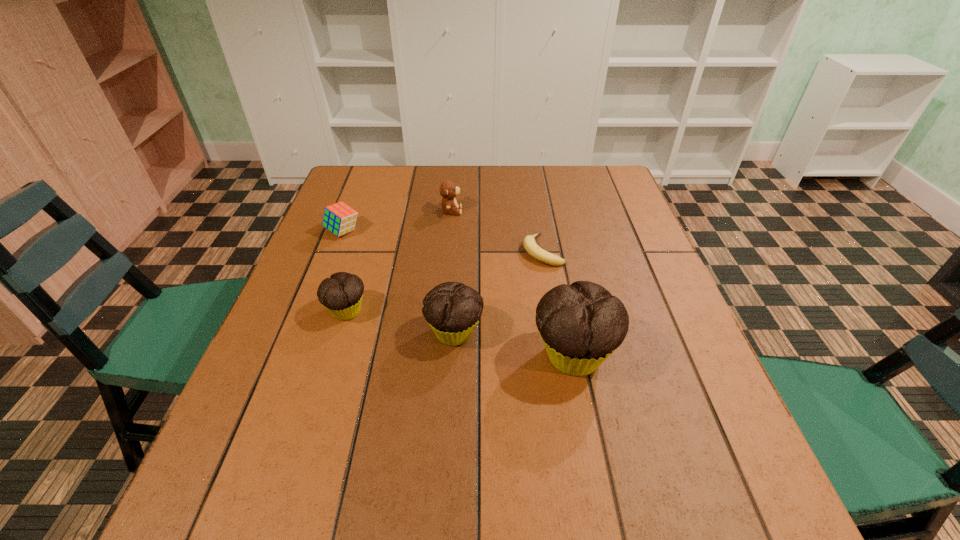
Find the location of a particular element. The width and height of the screenshot is (960, 540). free location at the right edge is located at coordinates (583, 207).

This screenshot has width=960, height=540. I want to click on free spot at the far left corner of the desktop, so tap(370, 166).

Image resolution: width=960 pixels, height=540 pixels. I want to click on vacant area at the far right corner, so click(574, 179).

Find the location of a particular element. vacant region between the rightmost muffin and the second shortest muffin is located at coordinates (514, 344).

Locate an element on the screen. The width and height of the screenshot is (960, 540). free space that is in between the leftmost muffin and the teddy bear is located at coordinates (399, 261).

I want to click on empty location between the teddy bear and the cube, so click(x=397, y=221).

This screenshot has width=960, height=540. I want to click on vacant area that lies between the teddy bear and the cube, so click(397, 221).

Where is `free area in between the cube and the banana`? This screenshot has width=960, height=540. free area in between the cube and the banana is located at coordinates (443, 241).

Image resolution: width=960 pixels, height=540 pixels. I want to click on vacant point located between the cube and the farthest object, so click(x=397, y=221).

You are a GUI agent. You are given a task and a screenshot of the screen. Output one action in this format:
    pyautogui.click(x=<x>, y=<y>)
    Task: Click on the free space between the second muffin from left to right and the farthest object
    The image size is (960, 540).
    Given the screenshot: What is the action you would take?
    pyautogui.click(x=453, y=272)